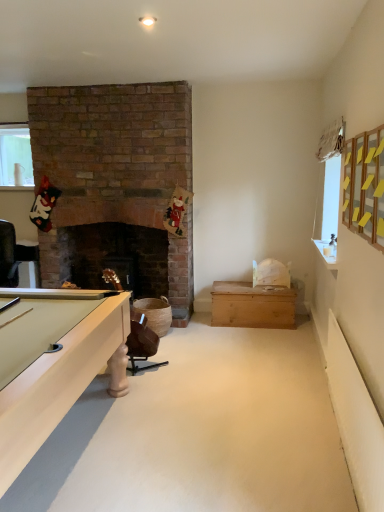
Where is `clear glass vase at upper left`? The width and height of the screenshot is (384, 512). clear glass vase at upper left is located at coordinates (15, 156).

At what (x,y) coordinates should I click in order to perform the action: click on white glossy counter top at upper right. Please return your answer as a coordinate pair (x, y). Looking at the image, I should click on (327, 255).

At what (x,y) coordinates should I click in order to perform the action: click on wooden chest at center. Please return your answer as a coordinate pair (x, y). The height and width of the screenshot is (512, 384). Looking at the image, I should click on (252, 311).

Consider the image. From the image's perspective, between white glossy counter top at upper right and brown leather chair at lower center, who is located below?

brown leather chair at lower center, from the image's perspective.

How different are the orientations of white glossy counter top at upper right and brown leather chair at lower center in degrees?

They differ by 91.1 degrees in their facing directions.

Is white glossy counter top at upper right positioned behind brown leather chair at lower center?

No.

Is white glossy counter top at upper right shorter than brown leather chair at lower center?

Yes.

Is clear glass vase at upper left positioned before white glossy counter top at upper right?

No, clear glass vase at upper left is behind white glossy counter top at upper right.

Is point (19, 137) closer or farther from the camera than point (315, 239)?

Clearly, point (19, 137) is more distant from the camera than point (315, 239).

Does clear glass vase at upper left have a larger size compared to white glossy counter top at upper right?

Correct, clear glass vase at upper left is larger in size than white glossy counter top at upper right.

Considering the positions of objects clear glass vase at upper left and white glossy counter top at upper right in the image provided, who is more to the right, clear glass vase at upper left or white glossy counter top at upper right?

white glossy counter top at upper right.

Considering the sizes of white glossy counter top at upper right and clear glass vase at upper left in the image, is white glossy counter top at upper right taller or shorter than clear glass vase at upper left?

In the image, white glossy counter top at upper right appears to be shorter than clear glass vase at upper left.

In the scene shown: From the image's perspective, is white glossy counter top at upper right located above or below clear glass vase at upper left?

Based on their image positions, white glossy counter top at upper right is located beneath clear glass vase at upper left.

Looking at their sizes, would you say white glossy counter top at upper right is wider or thinner than clear glass vase at upper left?

white glossy counter top at upper right is wider than clear glass vase at upper left.

From a real-world perspective, is white glossy counter top at upper right over clear glass vase at upper left?

Actually, white glossy counter top at upper right is physically below clear glass vase at upper left in the real world.

Relative to white glossy counter top at upper right, is wooden chest at center in front or behind?

In the image, wooden chest at center appears behind white glossy counter top at upper right.

Is white glossy counter top at upper right at the back of wooden chest at center?

No.

From the image's perspective, who appears lower, wooden chest at center or white glossy counter top at upper right?

From the image's view, wooden chest at center is below.

Is wooden chest at center thinner than white glossy counter top at upper right?

Incorrect, the width of wooden chest at center is not less than that of white glossy counter top at upper right.

From the image's perspective, which one is positioned lower, brown leather chair at lower center or clear glass vase at upper left?

brown leather chair at lower center is shown below in the image.

Considering the sizes of objects brown leather chair at lower center and clear glass vase at upper left in the image provided, who is shorter, brown leather chair at lower center or clear glass vase at upper left?

Standing shorter between the two is clear glass vase at upper left.

Can you confirm if brown leather chair at lower center is wider than clear glass vase at upper left?

Yes.

From a real-world perspective, is wooden chest at center located higher than brown leather chair at lower center?

Incorrect, from a real-world perspective, wooden chest at center is lower than brown leather chair at lower center.

Considering the relative positions of wooden chest at center and brown leather chair at lower center in the image provided, is wooden chest at center to the left of brown leather chair at lower center from the viewer's perspective?

No.

Which is behind, wooden chest at center or brown leather chair at lower center?

wooden chest at center is behind.

Considering the positions of point (246, 301) and point (157, 336), is point (246, 301) closer or farther from the camera than point (157, 336)?

Point (246, 301) appears to be farther away from the viewer than point (157, 336).

Is brown leather chair at lower center placed right next to white glossy counter top at upper right?

No, brown leather chair at lower center is not next to white glossy counter top at upper right.

From the picture: In terms of height, does brown leather chair at lower center look taller or shorter compared to white glossy counter top at upper right?

brown leather chair at lower center is taller than white glossy counter top at upper right.

The image size is (384, 512). Identify the location of counter top located above the brown leather chair at lower center (from the image's perspective). (327, 255).

Between brown leather chair at lower center and white glossy counter top at upper right, which one has smaller width?

white glossy counter top at upper right is thinner.

The image size is (384, 512). I want to click on counter top above the brown leather chair at lower center (from a real-world perspective), so click(x=327, y=255).

Locate an element on the screen. The height and width of the screenshot is (512, 384). counter top in front of the clear glass vase at upper left is located at coordinates (327, 255).

Estimate the real-world distances between objects in this image. Which object is further from white glossy counter top at upper right, wooden chest at center or clear glass vase at upper left?

clear glass vase at upper left.

From the image, which object appears to be nearer to white glossy counter top at upper right, brown leather chair at lower center or wooden chest at center?

wooden chest at center lies closer to white glossy counter top at upper right than the other object.

From the image, which object appears to be farther from wooden chest at center, brown leather chair at lower center or white glossy counter top at upper right?

Among the two, white glossy counter top at upper right is located further to wooden chest at center.

Looking at the image, which one is located closer to clear glass vase at upper left, brown leather chair at lower center or wooden chest at center?

brown leather chair at lower center is closer to clear glass vase at upper left.

Considering their positions, is white glossy counter top at upper right positioned closer to wooden chest at center than clear glass vase at upper left?

white glossy counter top at upper right is positioned closer to the anchor wooden chest at center.

Based on their spatial positions, is white glossy counter top at upper right or clear glass vase at upper left closer to brown leather chair at lower center?

Among the two, white glossy counter top at upper right is located nearer to brown leather chair at lower center.

Which object lies nearer to the anchor point clear glass vase at upper left, brown leather chair at lower center or white glossy counter top at upper right?

Based on the image, brown leather chair at lower center appears to be nearer to clear glass vase at upper left.

Estimate the real-world distances between objects in this image. Which object is closer to clear glass vase at upper left, white glossy counter top at upper right or wooden chest at center?

wooden chest at center is positioned closer to the anchor clear glass vase at upper left.

Where is `chair between clear glass vase at upper left and white glossy counter top at upper right`? The height and width of the screenshot is (512, 384). chair between clear glass vase at upper left and white glossy counter top at upper right is located at coordinates (141, 342).

At what (x,y) coordinates should I click in order to perform the action: click on chair between clear glass vase at upper left and wooden chest at center from left to right. Please return your answer as a coordinate pair (x, y). The width and height of the screenshot is (384, 512). Looking at the image, I should click on (141, 342).

The height and width of the screenshot is (512, 384). I want to click on drawer situated between clear glass vase at upper left and white glossy counter top at upper right from left to right, so click(252, 311).

Identify the location of drawer between brown leather chair at lower center and white glossy counter top at upper right in the horizontal direction. This screenshot has width=384, height=512. (252, 311).